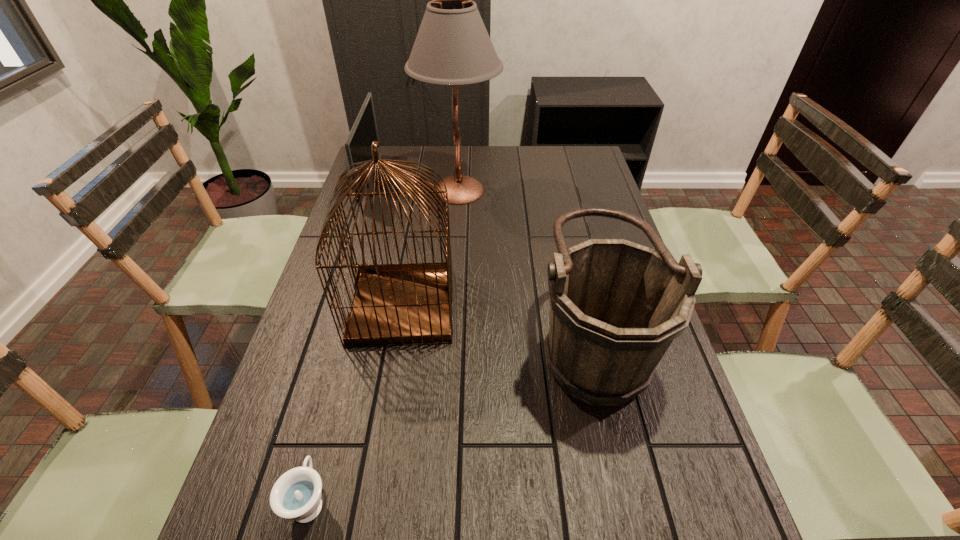
You are a GUI agent. You are given a task and a screenshot of the screen. Output one action in this format:
    pyautogui.click(x=<x>, y=<y>)
    Task: Click on the tallest object
    The image size is (960, 540).
    Given the screenshot: What is the action you would take?
    pyautogui.click(x=452, y=47)

Find the location of a particular element. The width and height of the screenshot is (960, 540). birdcage is located at coordinates (395, 304).

Where is `the third shortest object`? Image resolution: width=960 pixels, height=540 pixels. the third shortest object is located at coordinates (616, 306).

Where is `the rightmost object`? The width and height of the screenshot is (960, 540). the rightmost object is located at coordinates (616, 306).

Where is `the leftmost object`? the leftmost object is located at coordinates (364, 131).

Identify the location of monitor. 364,131.

Find the location of `the nearest object`. the nearest object is located at coordinates (296, 495).

Image resolution: width=960 pixels, height=540 pixels. Identify the location of the shortest object. (296, 495).

Image resolution: width=960 pixels, height=540 pixels. Find the location of `vacant space located on the front-facing side of the tallest object`. vacant space located on the front-facing side of the tallest object is located at coordinates (518, 191).

At what (x,y) coordinates should I click in order to perform the action: click on vacant space located 0.310m on the back of the birdcage. Please return your answer as a coordinate pair (x, y). Looking at the image, I should click on (419, 207).